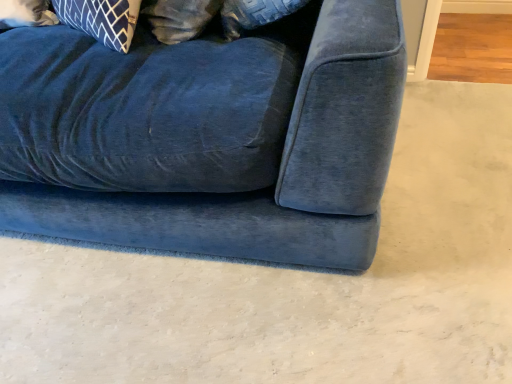
Describe the element at coordinates (279, 168) in the screenshot. The height and width of the screenshot is (384, 512). I see `velvet blue couch at lower left` at that location.

In order to face velvet blue couch at lower left, should I rotate leftwards or rightwards?

Turn left approximately 21.320 degrees to face it.

Identify the location of velvet blue couch at lower left. The image size is (512, 384). (279, 168).

Where is `velvet blue couch at lower left`? Image resolution: width=512 pixels, height=384 pixels. velvet blue couch at lower left is located at coordinates (279, 168).